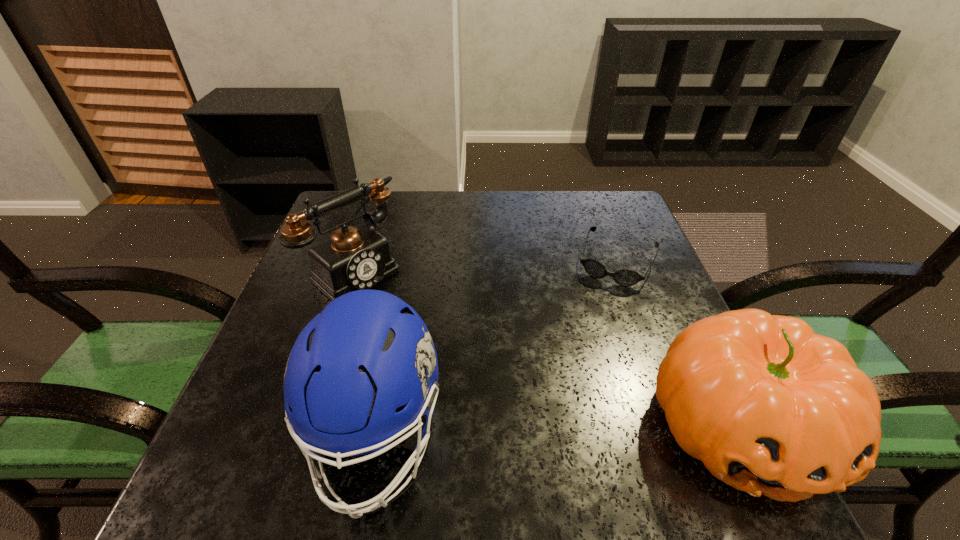
Locate an element on the screen. The width and height of the screenshot is (960, 540). football helmet is located at coordinates (364, 371).

You are a GUI agent. You are given a task and a screenshot of the screen. Output one action in this format:
    pyautogui.click(x=<x>, y=<y>)
    Task: Click on the pumpkin
    The height and width of the screenshot is (540, 960).
    Given the screenshot: What is the action you would take?
    pyautogui.click(x=770, y=407)

The image size is (960, 540). I want to click on the shortest object, so click(625, 277).

Where is `telephone`? telephone is located at coordinates (355, 258).

I want to click on free space located 0.090m on the lenses of the sunglasses, so click(x=597, y=310).

In order to click on free space located 0.130m on the lenses of the sunglasses in this screenshot , I will do `click(593, 322)`.

In order to click on vacant space located 0.360m on the lenses of the sunglasses in this screenshot , I will do `click(561, 405)`.

I want to click on free space located on the front of the telephone at the rotary dial, so click(450, 353).

Find the location of a particular element. free space located 0.190m on the front of the telephone at the rotary dial is located at coordinates (434, 340).

This screenshot has height=540, width=960. What are the coordinates of `blank area located on the front of the telephone at the rotary dial` in the screenshot? It's located at (450, 353).